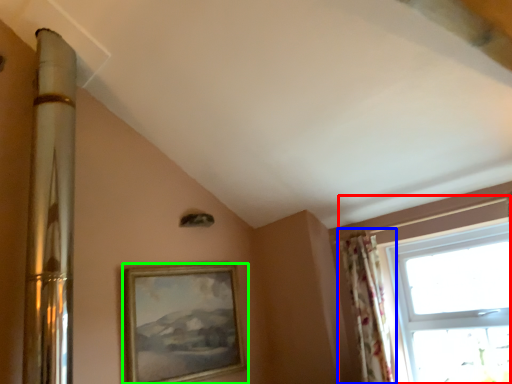
Question: Which is nearer to the window (highlighted by a red box)? curtain (highlighted by a blue box) or picture frame (highlighted by a green box).

Choices:
 (A) curtain
 (B) picture frame

Answer: (A)